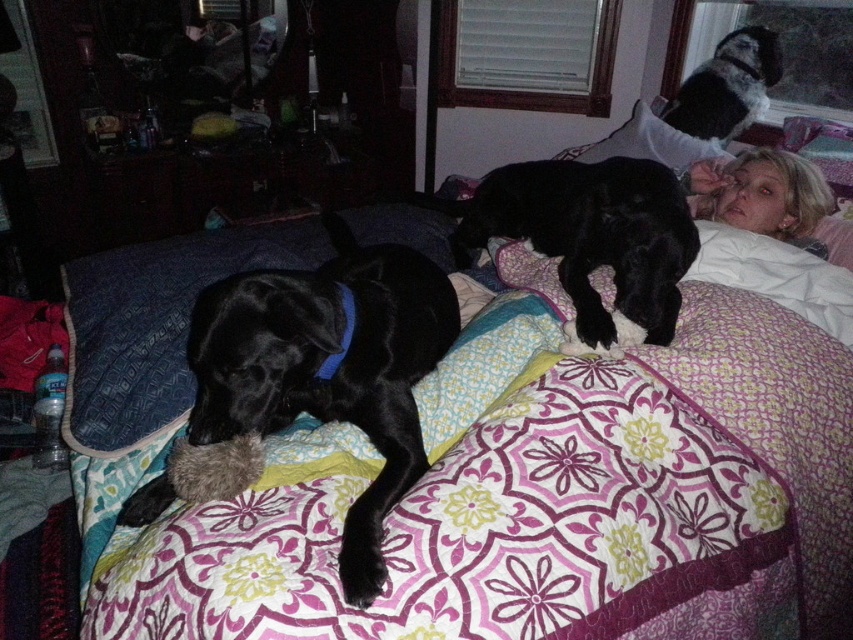
Between blonde hair at upper right and black fur dog at upper right, which one is positioned lower?

blonde hair at upper right is below.

From the picture: Between blonde hair at upper right and black fur dog at upper right, which one has less height?

Standing shorter between the two is blonde hair at upper right.

Between point (825, 211) and point (717, 125), which one is positioned in front?

Point (825, 211) is in front.

Identify the location of blonde hair at upper right. This screenshot has height=640, width=853. (761, 193).

Between point (732, 192) and point (663, 134), which one is positioned behind?

The point (663, 134) is more distant.

Can you confirm if blonde hair at upper right is positioned to the left of fluffy white pillow at upper right?

In fact, blonde hair at upper right is to the right of fluffy white pillow at upper right.

The image size is (853, 640). Describe the element at coordinates (761, 193) in the screenshot. I see `blonde hair at upper right` at that location.

You are a GUI agent. You are given a task and a screenshot of the screen. Output one action in this format:
    pyautogui.click(x=<x>, y=<y>)
    Task: Click on the blonde hair at upper right
    
    Given the screenshot: What is the action you would take?
    pyautogui.click(x=761, y=193)

Between floral-patterned quilt at center and matte black dog at left, which one is positioned lower?

floral-patterned quilt at center is lower down.

Does point (821, 474) lie behind point (374, 262)?

No, (821, 474) is in front of (374, 262).

At what (x,y) coordinates should I click in order to perform the action: click on floral-patterned quilt at center. Please return your answer as a coordinate pair (x, y). This screenshot has width=853, height=640. Looking at the image, I should click on (547, 497).